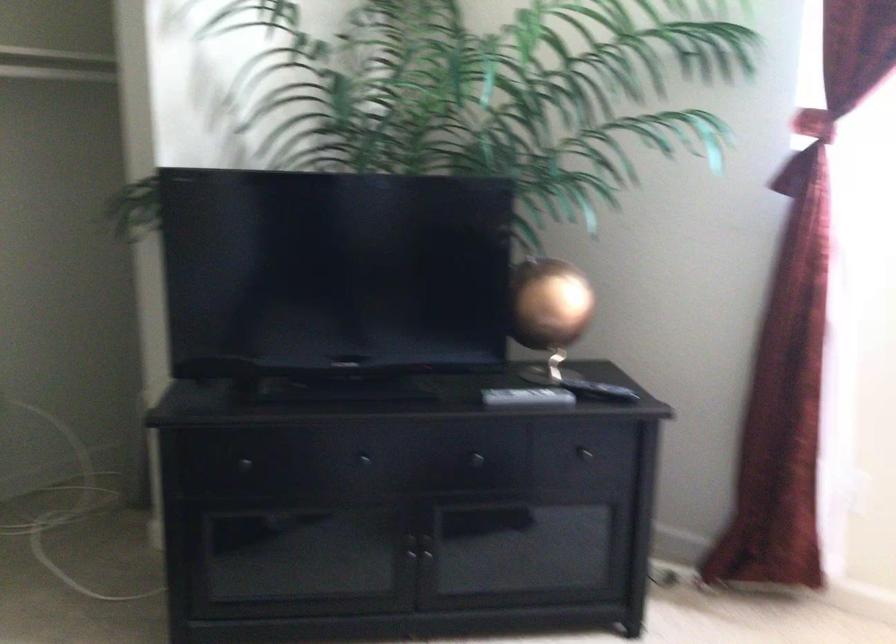
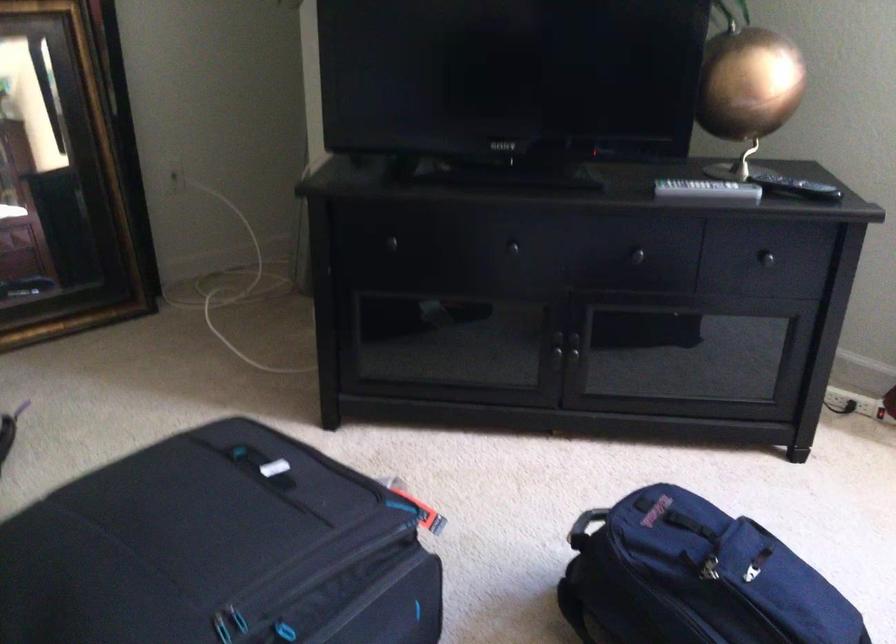
Question: The images are taken continuously from a first-person perspective. In which direction is your viewpoint rotating?

Choices:
 (A) Left
 (B) Right
 (C) Up
 (D) Down

Answer: (A)